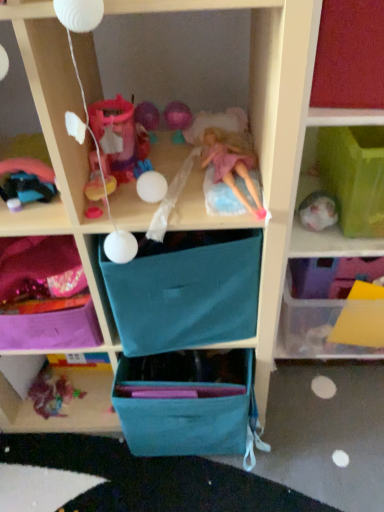
This screenshot has width=384, height=512. In order to click on vacant space to the right of teal fabric drawer at lower center, which is counted as the 1th drawer, starting from the bottom in this screenshot , I will do `click(275, 449)`.